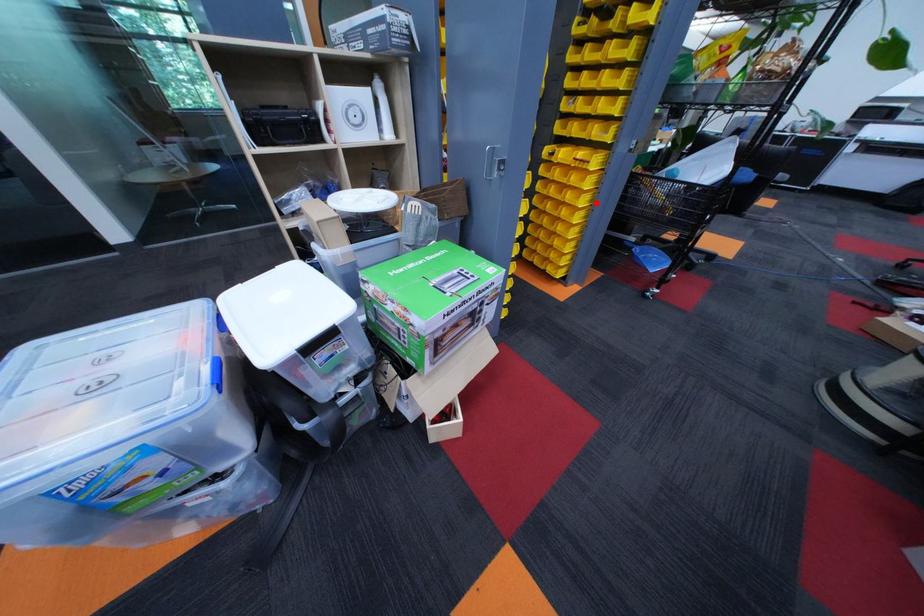
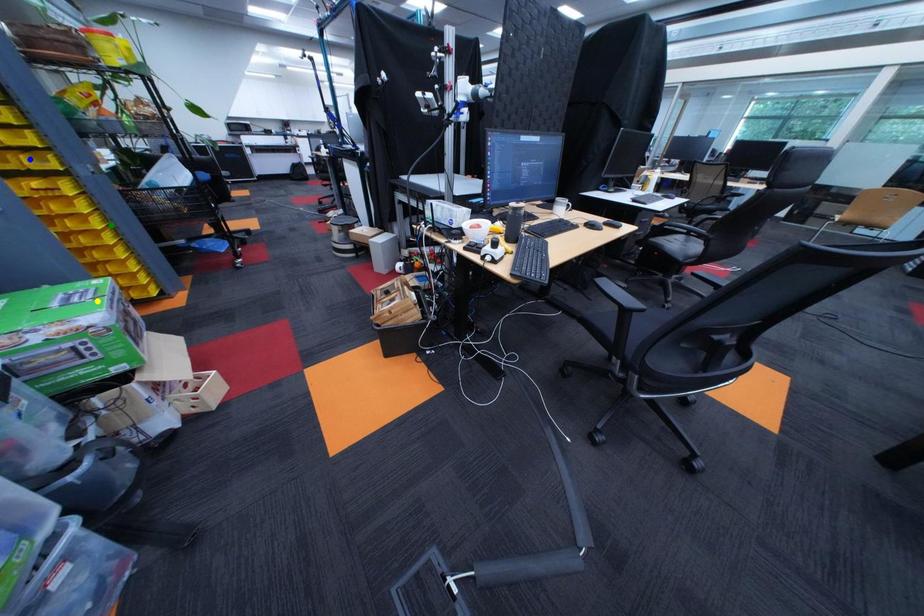
Question: I am providing you with two images of the same scene from different viewpoints. A red point is marked on the first image. You are given multiple points on the second image. Can you choose the point in image 2 that corresponds to the point in image 1?

Choices:
 (A) blue point
 (B) green point
 (C) yellow point

Answer: (B)